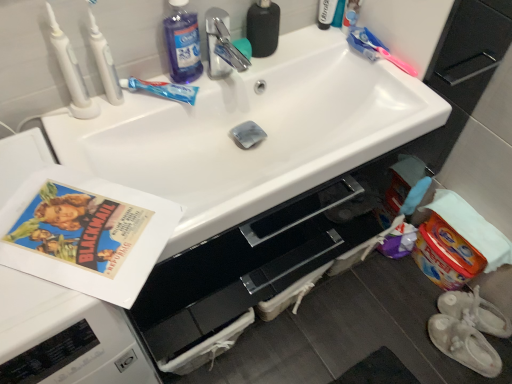
Locate an element on the screen. Image resolution: width=512 pixels, height=384 pixels. free space to the left of pink plastic toothbrush at upper right, the 1th toothbrush viewed from the right is located at coordinates tap(334, 58).